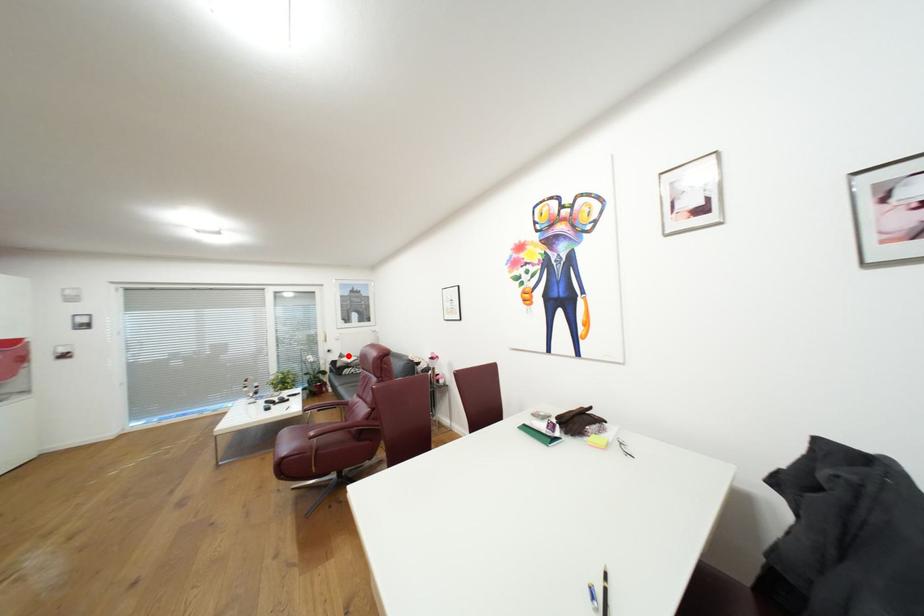
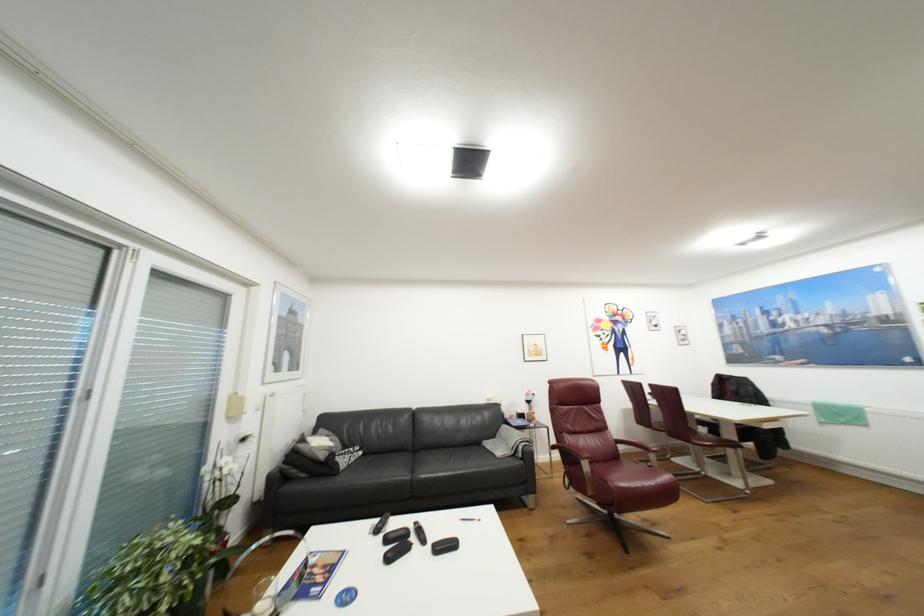
Find the pixel in the second image that matches the highlighted location in the first image.

(309, 440)